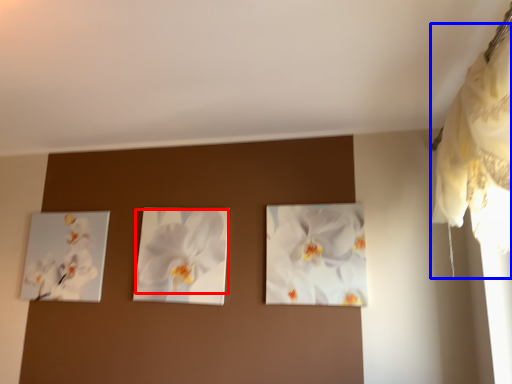
Question: Among these objects, which one is farthest to the camera, flower (highlighted by a red box) or curtain (highlighted by a blue box)?

Choices:
 (A) flower
 (B) curtain

Answer: (A)